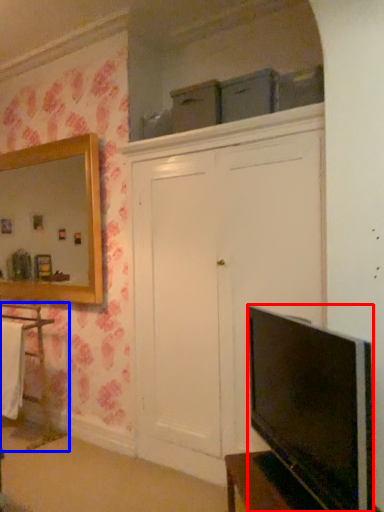
Question: Which object is further to the camera taking this photo, television (highlighted by a red box) or cabinetry (highlighted by a blue box)?

Choices:
 (A) television
 (B) cabinetry

Answer: (B)